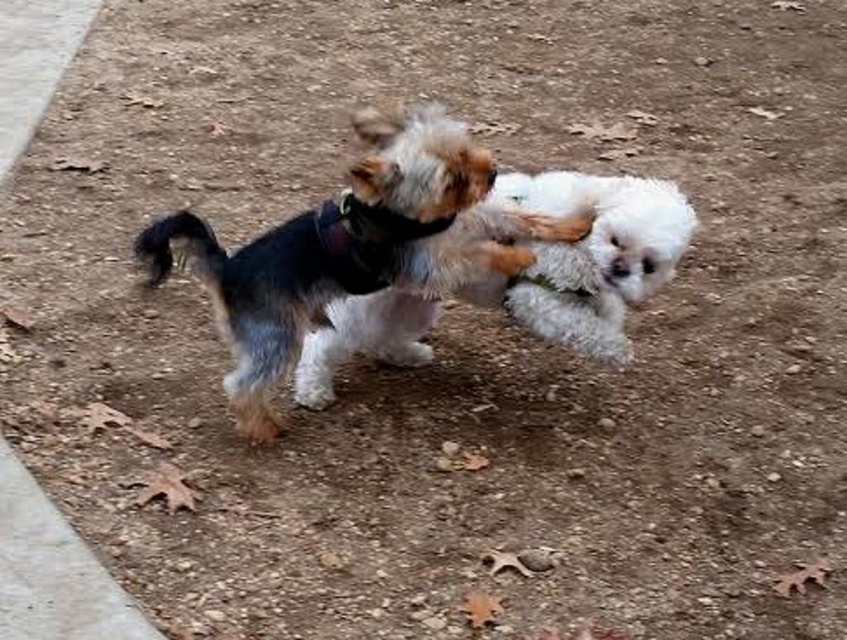
You are a photographer standing in front of the two dogs. You want to take a clear photo of the soft fur dog at center and the fluffy white dog at center. Which dog should you focus on first to ensure both are in focus?

You should focus on the soft fur dog at center first because it is closer to the viewer than the fluffy white dog at center, so adjusting focus from near to far will help both be in focus.